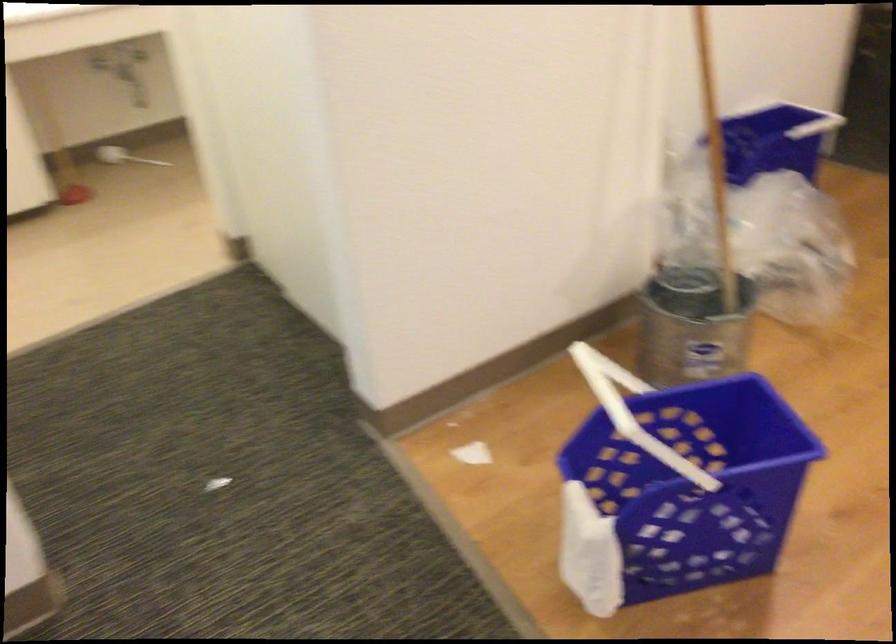
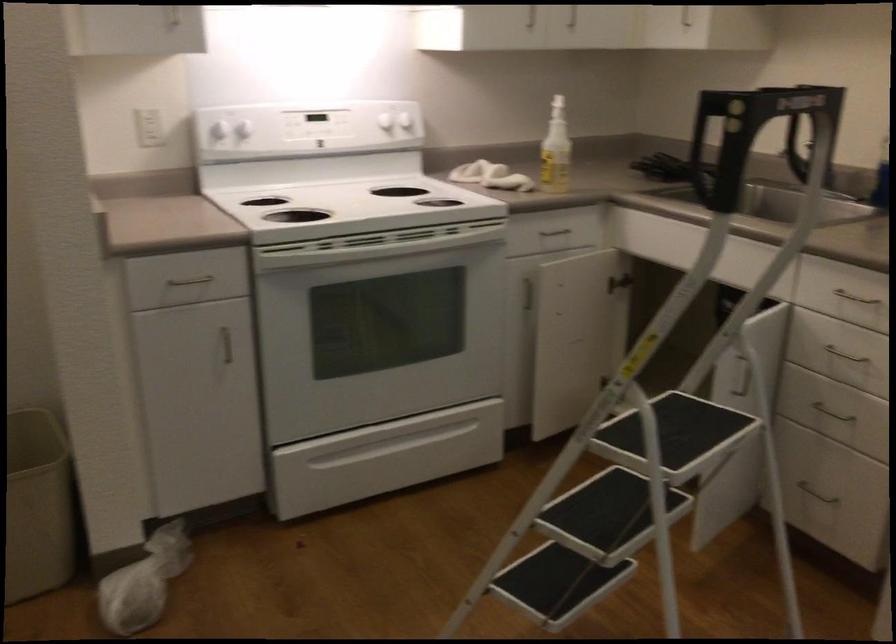
Question: How did the camera likely rotate?

Choices:
 (A) Left
 (B) Right
 (C) Up
 (D) Down

Answer: (B)